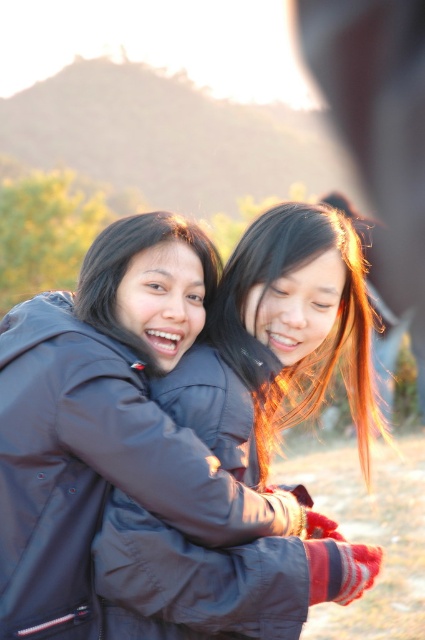
Question: Can you confirm if matte black jacket at center is smaller than shiny black hair at center?

Choices:
 (A) yes
 (B) no

Answer: (B)

Question: Is matte black jacket at center wider than shiny black hair at center?

Choices:
 (A) no
 (B) yes

Answer: (B)

Question: Among these objects, which one is farthest from the camera?

Choices:
 (A) matte black jacket at center
 (B) shiny black hair at center

Answer: (B)

Question: Which object appears farthest from the camera in this image?

Choices:
 (A) shiny black hair at center
 (B) matte black jacket at center

Answer: (A)

Question: Is matte black jacket at center further to the viewer compared to shiny black hair at center?

Choices:
 (A) yes
 (B) no

Answer: (B)